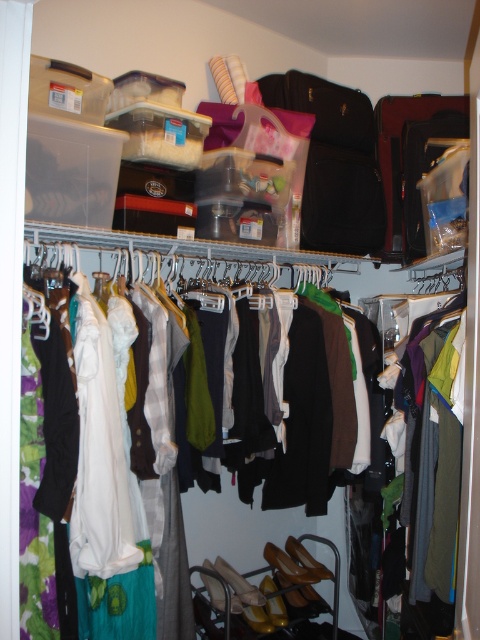
You are standing in front of the closet and want to reach the black leather suitcase at upper right. Considering your height is 5.5 feet, can you comfortably reach it without any assistance?

The black leather suitcase at upper right is 7.44 feet away from viewer. Since your height is 5.5 feet, you cannot comfortably reach it without assistance as the suitcase is higher than your height.

You are standing in front of the closet and want to reach the point at coordinate point[260,253]. The closet has a height of 7 feet. Can you safely reach that point without standing on a stool?

The point at coordinate point[260,253] is 7.30 feet away from you. Since the closet is 7 feet tall, you cannot safely reach that point without standing on a stool because the distance exceeds the closet height.

You are organizing the closet and need to access the white plastic hanger at center. However, the black leather suitcase at upper right is blocking it. Can you move the suitcase to the left to make space?

The white plastic hanger at center is behind the black leather suitcase at upper right, so moving the suitcase to the left might not be necessary. You can simply reach around or behind the suitcase to access the hanger.